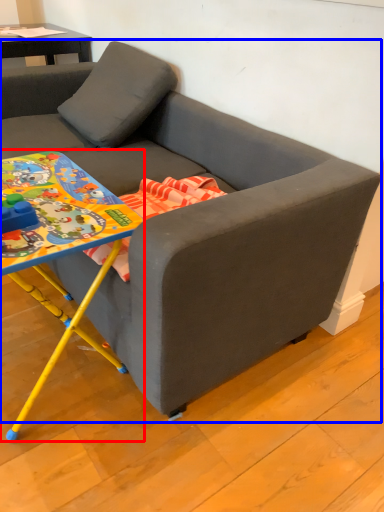
Question: Among these objects, which one is farthest to the camera, table (highlighted by a red box) or studio couch (highlighted by a blue box)?

Choices:
 (A) table
 (B) studio couch

Answer: (A)